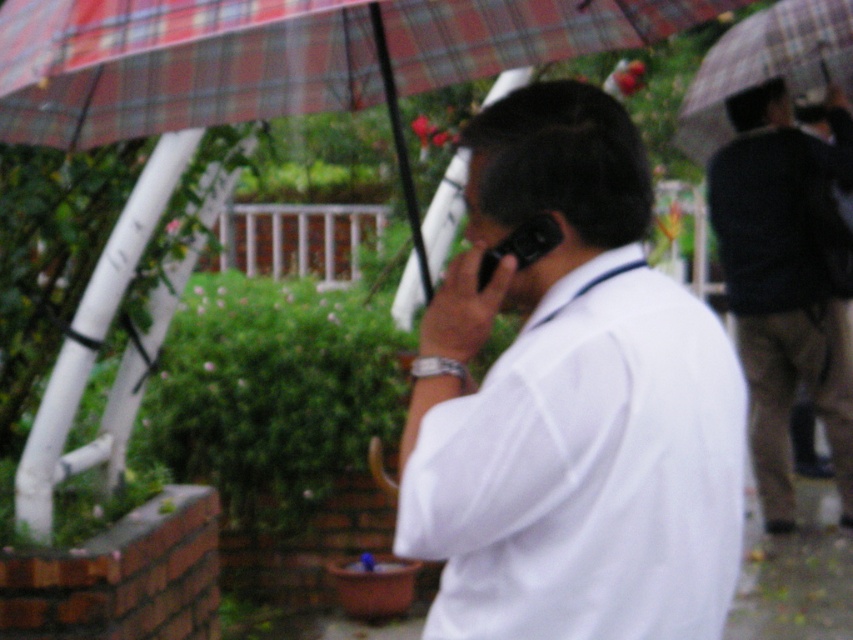
Question: Which object is positioned closest to the white matte shirt at center?

Choices:
 (A) plaid fabric umbrella at upper center
 (B) black plastic phone at upper center
 (C) dark brown pants at right

Answer: (B)

Question: Is dark brown pants at right thinner than black plastic phone at upper center?

Choices:
 (A) no
 (B) yes

Answer: (A)

Question: Which object is closer to the camera taking this photo?

Choices:
 (A) plaid fabric umbrella at upper center
 (B) dark brown pants at right

Answer: (A)

Question: Can you confirm if plaid fabric umbrella at upper center is wider than black plastic phone at upper center?

Choices:
 (A) yes
 (B) no

Answer: (A)

Question: Is white matte shirt at center above black plastic phone at upper center?

Choices:
 (A) yes
 (B) no

Answer: (B)

Question: Which point is closer to the camera taking this photo?

Choices:
 (A) (311, 67)
 (B) (535, 236)
 (C) (778, 412)

Answer: (B)